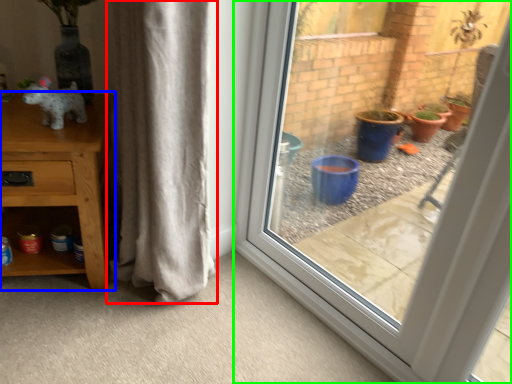
Question: Based on their relative distances, which object is farther from curtain (highlighted by a red box)? Choose from furniture (highlighted by a blue box) and window (highlighted by a green box).

Choices:
 (A) furniture
 (B) window

Answer: (B)